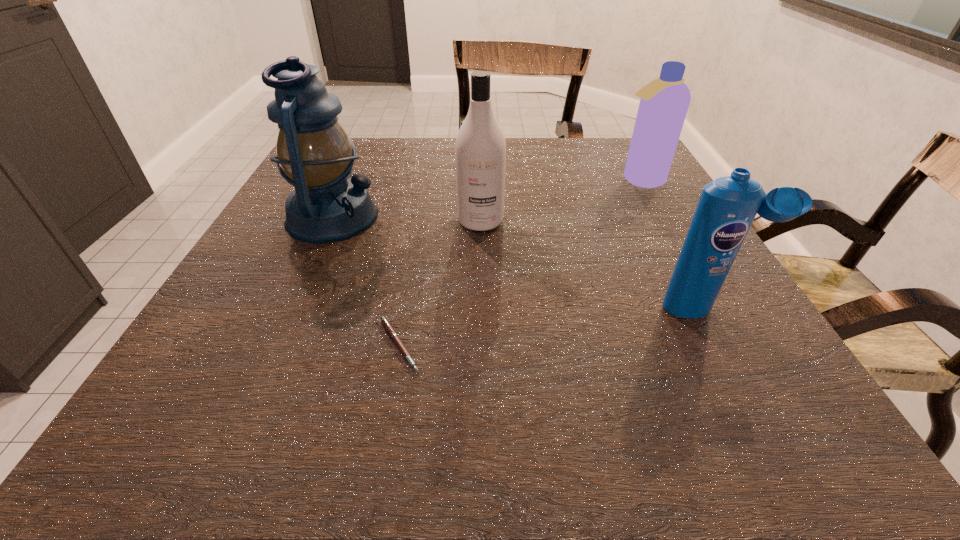
You are a GUI agent. You are given a task and a screenshot of the screen. Output one action in this format:
    pyautogui.click(x=<x>, y=<y>)
    Task: Click on the free spot between the nearest shampoo and the farthest shampoo
    
    Given the screenshot: What is the action you would take?
    pyautogui.click(x=672, y=244)

Where is `free space between the farthest shampoo and the nearest shampoo`? Image resolution: width=960 pixels, height=540 pixels. free space between the farthest shampoo and the nearest shampoo is located at coordinates (672, 244).

Locate an element on the screen. The height and width of the screenshot is (540, 960). vacant space in between the nearest shampoo and the leftmost object is located at coordinates (518, 262).

Locate an element on the screen. The image size is (960, 540). free space between the second farthest shampoo and the shortest object is located at coordinates (440, 283).

Find the location of a particular element. free area in between the pen and the farthest shampoo is located at coordinates (519, 262).

Locate an element on the screen. This screenshot has width=960, height=540. vacant space in between the farthest shampoo and the third object from left to right is located at coordinates (560, 200).

The height and width of the screenshot is (540, 960). What are the coordinates of `empty space between the nearest shampoo and the lantern` in the screenshot? It's located at (518, 262).

Find the location of a particular element. vacant space that is in between the nearest shampoo and the pen is located at coordinates (552, 327).

Image resolution: width=960 pixels, height=540 pixels. Find the location of `vacant space that's between the second farthest shampoo and the farthest shampoo`. vacant space that's between the second farthest shampoo and the farthest shampoo is located at coordinates (560, 200).

In order to click on the second closest object to the lantern in this screenshot , I will do `click(385, 322)`.